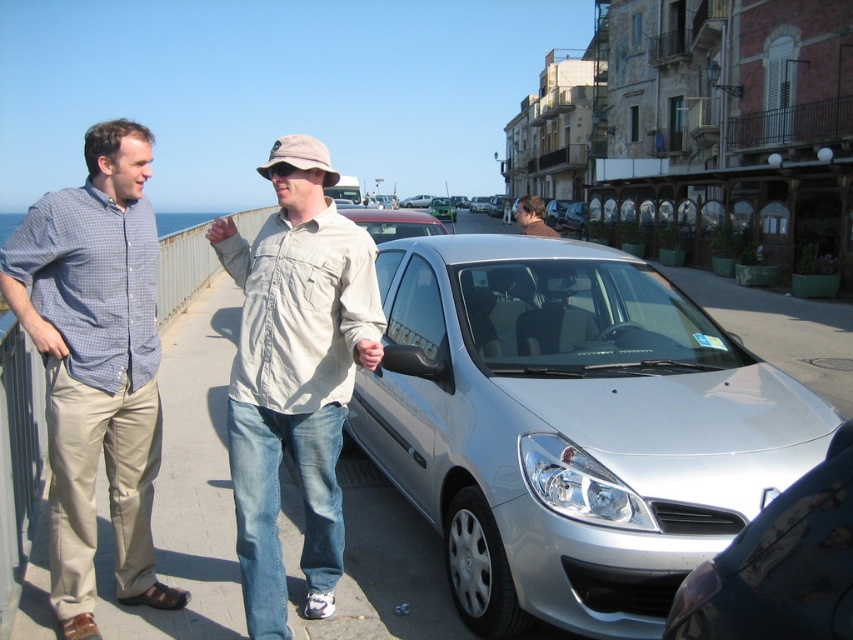
Does matte blue shirt at left have a greater height compared to light beige cotton shirt at center?

Yes.

In the scene shown: Who is positioned more to the right, matte blue shirt at left or light beige cotton shirt at center?

From the viewer's perspective, light beige cotton shirt at center appears more on the right side.

Which is behind, point (49, 282) or point (259, 538)?

The point (49, 282) is more distant.

Image resolution: width=853 pixels, height=640 pixels. I want to click on matte blue shirt at left, so click(x=96, y=365).

In the scene shown: Can you confirm if silver metallic car at center is smaller than matte beige shirt at center?

Indeed, silver metallic car at center has a smaller size compared to matte beige shirt at center.

Locate an element on the screen. The height and width of the screenshot is (640, 853). silver metallic car at center is located at coordinates (572, 428).

Identify the location of silver metallic car at center. (572, 428).

Is light beige cotton shirt at center to the right of satin silver sedan at center from the viewer's perspective?

In fact, light beige cotton shirt at center is to the left of satin silver sedan at center.

The image size is (853, 640). Describe the element at coordinates (294, 374) in the screenshot. I see `light beige cotton shirt at center` at that location.

Where is `light beige cotton shirt at center`? light beige cotton shirt at center is located at coordinates (294, 374).